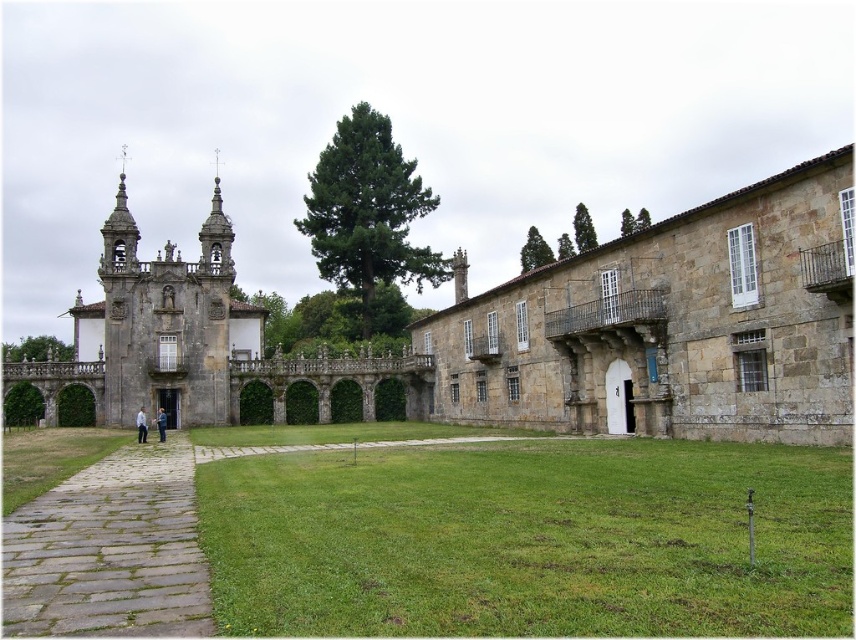
Question: Among these objects, which one is farthest from the camera?

Choices:
 (A) light blue fabric jacket at center
 (B) brown stone building at center
 (C) green grass at center

Answer: (A)

Question: Does brown stone building at center lie behind gray stone path at lower left?

Choices:
 (A) yes
 (B) no

Answer: (A)

Question: Can you confirm if green grass at center is thinner than gray stone path at lower left?

Choices:
 (A) no
 (B) yes

Answer: (A)

Question: Estimate the real-world distances between objects in this image. Which object is closer to the gray stone path at lower left?

Choices:
 (A) light blue fabric jacket at center
 (B) green grass at center
 (C) white cotton shirt at center
 (D) brown stone building at center

Answer: (B)

Question: Which of the following is the farthest from the observer?

Choices:
 (A) green grass at center
 (B) brown stone building at center

Answer: (B)

Question: Does green grass at center come in front of light blue fabric jacket at center?

Choices:
 (A) yes
 (B) no

Answer: (A)